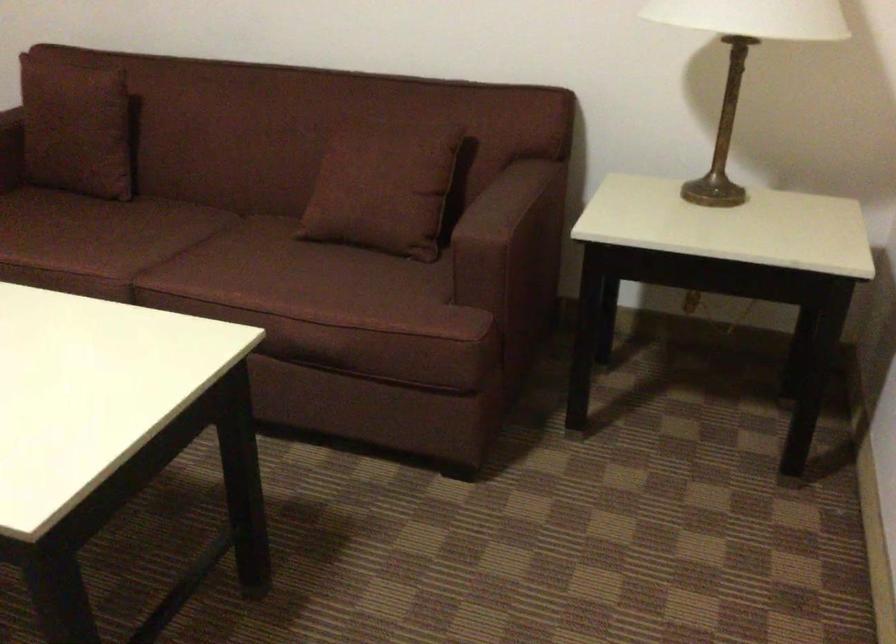
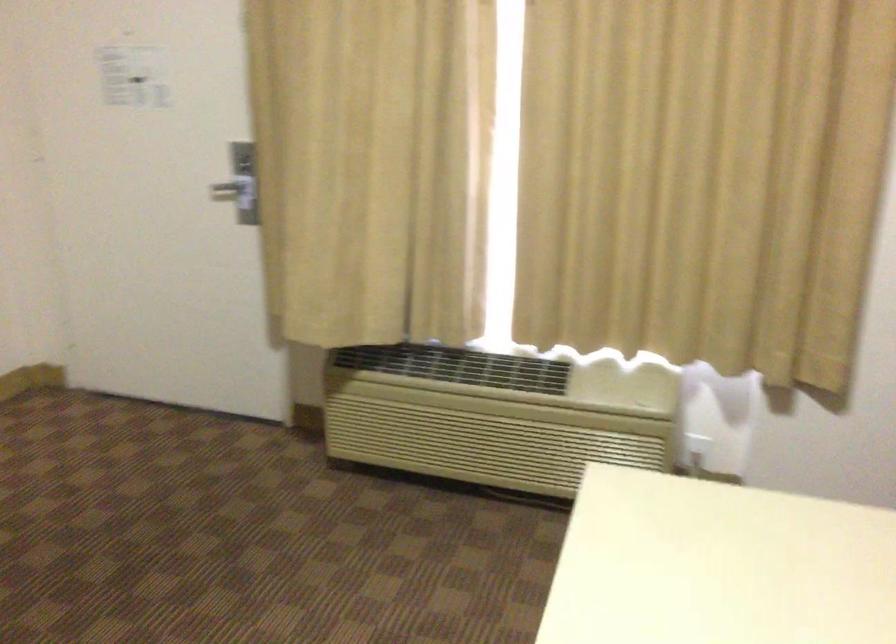
Question: The camera is either moving clockwise (left) or counter-clockwise (right) around the object. The first image is from the beginning of the video and the second image is from the end. Is the camera moving left or right when shooting the video?

Choices:
 (A) Left
 (B) Right

Answer: (B)